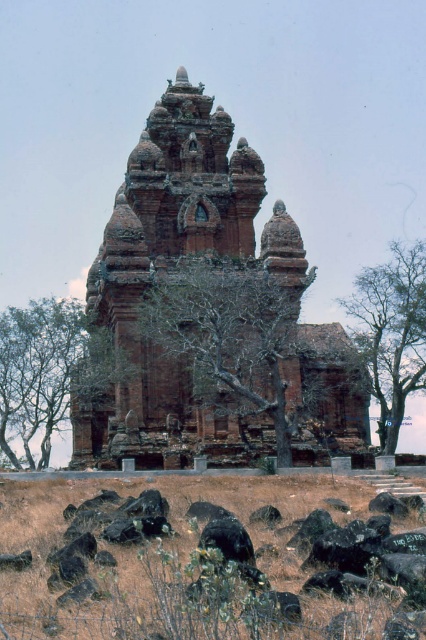
Who is lower down, brown stone temple at center or green leafy tree at center?

green leafy tree at center is below.

Does brown stone temple at center appear on the left side of green leafy tree at center?

Correct, you'll find brown stone temple at center to the left of green leafy tree at center.

Between point (293, 236) and point (376, 321), which one is positioned behind?

The point (293, 236) is more distant.

At what (x,y) coordinates should I click in order to perform the action: click on brown stone temple at center. Please return your answer as a coordinate pair (x, y). The image size is (426, 640). Looking at the image, I should click on (149, 284).

Is point (210, 504) positioned before point (394, 332)?

Yes, it is.

Does point (386, 532) lie behind point (382, 312)?

No, it is not.

Does point (247, 580) come in front of point (388, 369)?

Yes, it is in front of point (388, 369).

The image size is (426, 640). Find the location of `brown rock pile at center`. brown rock pile at center is located at coordinates (209, 557).

Can you confirm if brown stone temple at center is shorter than bare branches at center?

No.

Is brown stone temple at center bigger than bare branches at center?

Yes, brown stone temple at center is bigger than bare branches at center.

Where is `brown stone temple at center`? Image resolution: width=426 pixels, height=640 pixels. brown stone temple at center is located at coordinates (149, 284).